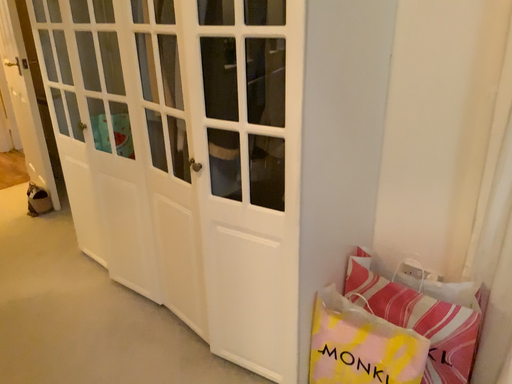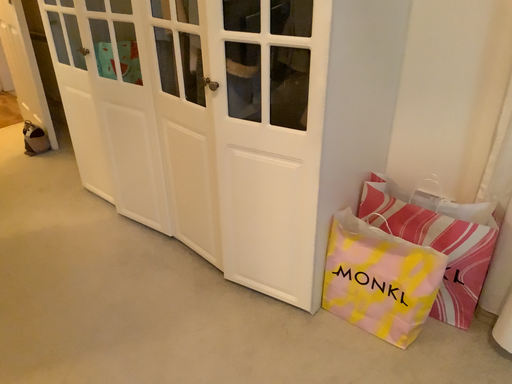
Question: How did the camera likely rotate when shooting the video?

Choices:
 (A) rotated downward
 (B) rotated upward

Answer: (A)